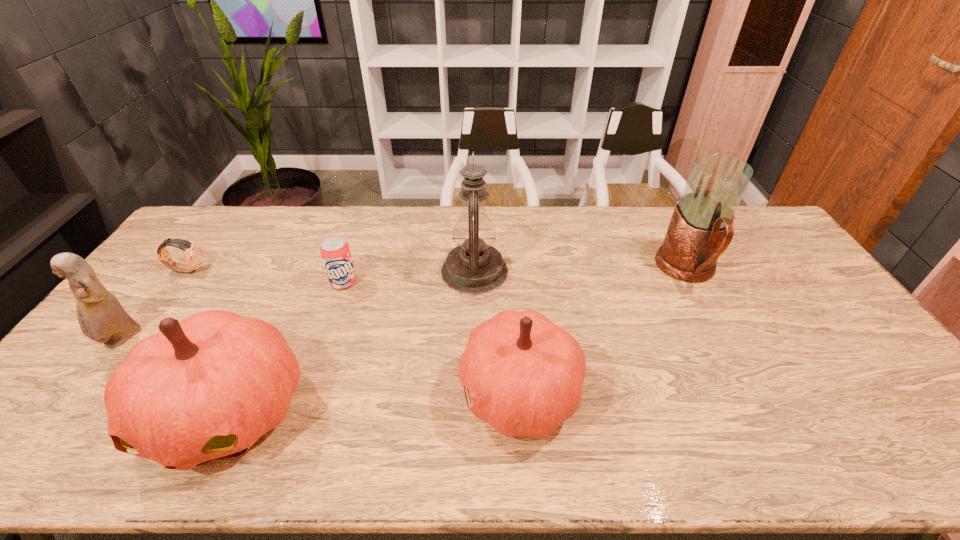
Observe the arrangement of all pumpkins in the image. To keep them evenly spaced, where would you place another pumpkin on the right? Please locate a free space. Please provide its 2D coordinates. Your answer should be formatted as a tuple, i.e. [(x, y)], where the tuple contains the x and y coordinates of a point satisfying the conditions above.

[(791, 374)]